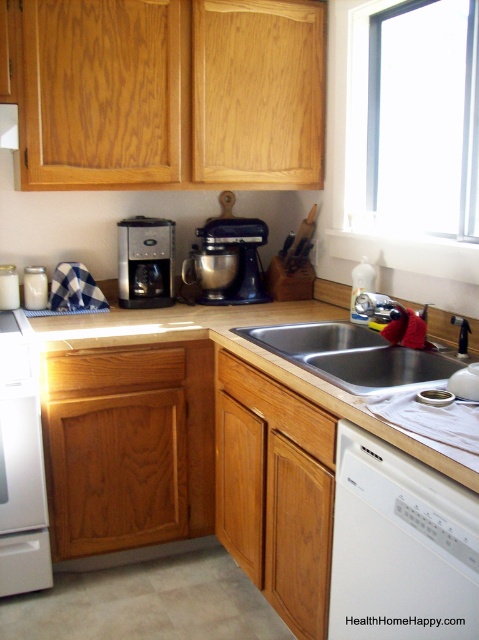
You are organizing a kitchen layout and need to place a new appliance. The matte black stand mixer at center is currently at coordinates 0.403, 0.476. If you want to place a new appliance 0.1 units to the right of the mixer, what will be the new x coordinate?

The new x coordinate would be 0.403 plus 0.1, which equals 0.503. So the new position would be at (228, 321).

You are organizing a kitchen inventory and need to determine which item takes up more space between the matte black stand mixer at center and the satin black coffee maker at center. Which one requires more storage space?

The matte black stand mixer at center is bigger than the satin black coffee maker at center, so it requires more storage space.